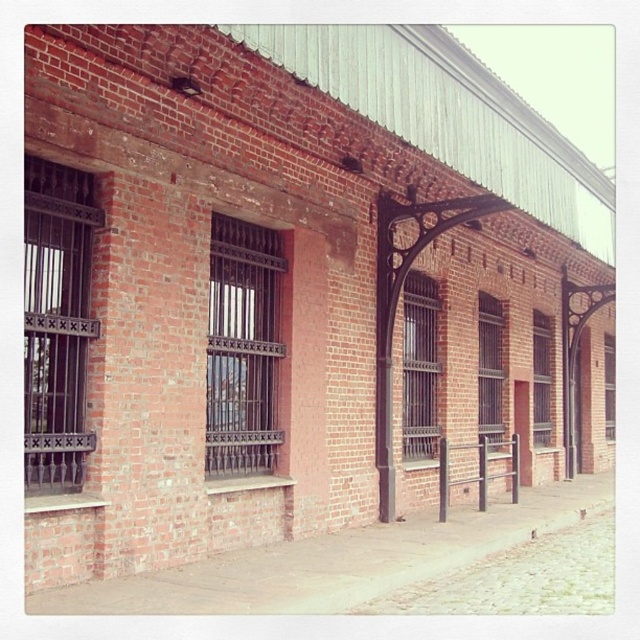
Is dark brown wrought iron window at center smaller than clear glass window at center?

No, dark brown wrought iron window at center is not smaller than clear glass window at center.

Is dark brown wrought iron window at center above clear glass window at center?

Correct, dark brown wrought iron window at center is located above clear glass window at center.

The image size is (640, 640). In order to click on dark brown wrought iron window at center in this screenshot , I will do `click(243, 348)`.

Based on the photo, who is lower down, dark brown metal bars at center or clear glass window at center?

clear glass window at center is below.

Can you confirm if dark brown metal bars at center is wider than clear glass window at center?

Indeed, dark brown metal bars at center has a greater width compared to clear glass window at center.

Between point (433, 339) and point (614, 396), which one is positioned behind?

The point (614, 396) is more distant.

Where is `dark brown metal bars at center`? dark brown metal bars at center is located at coordinates (419, 365).

This screenshot has width=640, height=640. I want to click on brown concrete pavement at lower center, so click(x=339, y=561).

Who is higher up, brown concrete pavement at lower center or matte black bars at center?

Positioned higher is matte black bars at center.

Between point (225, 586) and point (545, 413), which one is positioned in front?

Point (225, 586)

The image size is (640, 640). What are the coordinates of `brown concrete pavement at lower center` in the screenshot? It's located at (339, 561).